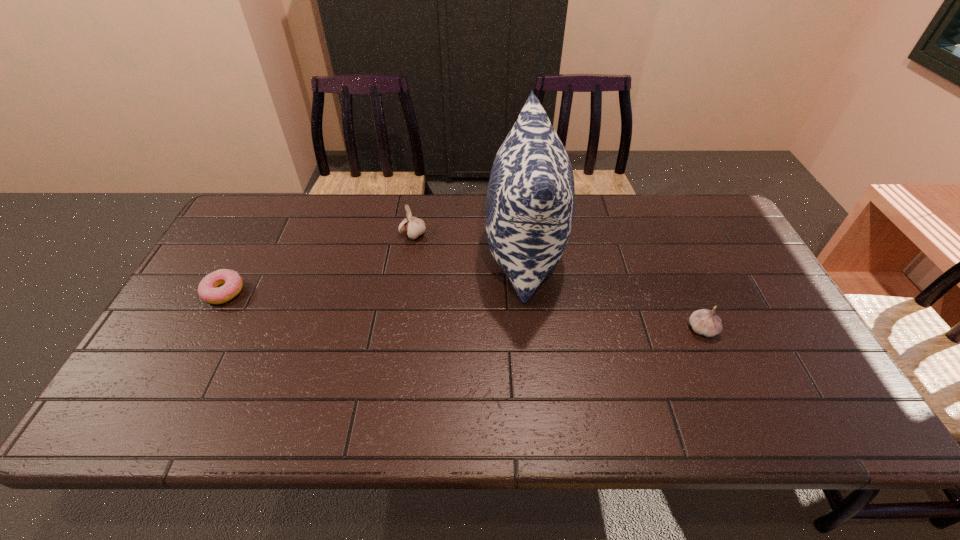
The image size is (960, 540). I want to click on the third object from left to right, so click(530, 203).

The width and height of the screenshot is (960, 540). Find the location of `the tallest object`. the tallest object is located at coordinates (530, 203).

Identify the location of the left garlic. (414, 227).

Find the location of a particular element. This screenshot has width=960, height=540. the second object from left to right is located at coordinates (414, 227).

Locate an element on the screen. the right garlic is located at coordinates (705, 322).

Locate an element on the screen. the nearest object is located at coordinates (705, 322).

You are a GUI agent. You are given a task and a screenshot of the screen. Output one action in this format:
    pyautogui.click(x=<x>, y=<y>)
    Task: Click on the doughnut
    The image size is (960, 540).
    Given the screenshot: What is the action you would take?
    pyautogui.click(x=209, y=291)

Locate an element on the screen. The height and width of the screenshot is (540, 960). the leftmost object is located at coordinates (209, 291).

Find the location of `free space located on the front surface of the third object from left to right`. free space located on the front surface of the third object from left to right is located at coordinates (452, 252).

Where is `free space located 0.180m on the front surface of the third object from left to right`? The image size is (960, 540). free space located 0.180m on the front surface of the third object from left to right is located at coordinates (425, 252).